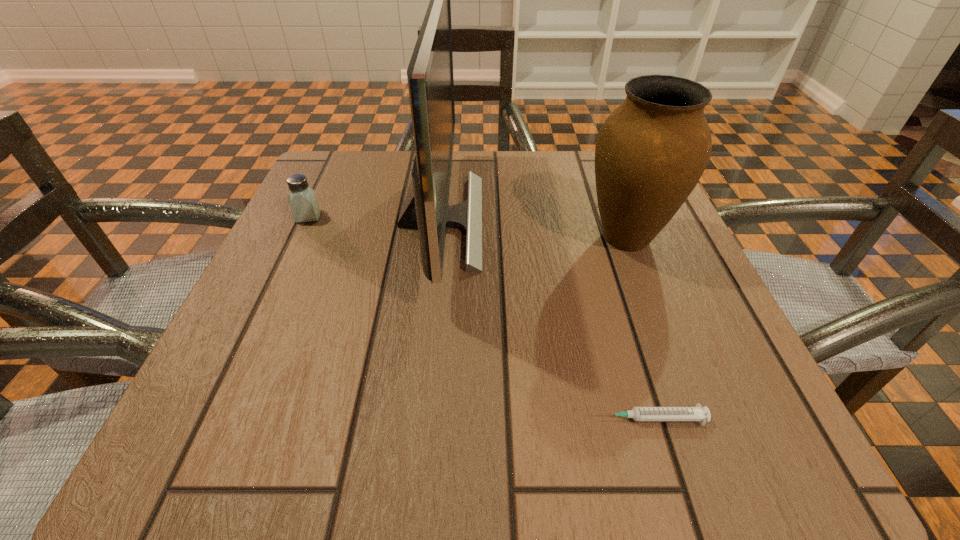
Image resolution: width=960 pixels, height=540 pixels. I want to click on free region that satisfies the following two spatial constraints: 1. on the front side of the urn; 2. on the left side of the leftmost object, so click(299, 238).

Identify the location of free space that satisfies the following two spatial constraints: 1. on the screen side of the second tallest object; 2. on the right side of the tallest object. The width and height of the screenshot is (960, 540). (439, 238).

Locate an element on the screen. Image resolution: width=960 pixels, height=540 pixels. free spot that satisfies the following two spatial constraints: 1. on the screen side of the tallest object; 2. on the back side of the urn is located at coordinates (439, 238).

Locate an element on the screen. free location that satisfies the following two spatial constraints: 1. on the screen side of the urn; 2. on the right side of the tallest object is located at coordinates (439, 238).

The image size is (960, 540). Find the location of `vacant space that satisfies the following two spatial constraints: 1. on the screen side of the monitor; 2. on the right side of the urn`. vacant space that satisfies the following two spatial constraints: 1. on the screen side of the monitor; 2. on the right side of the urn is located at coordinates (439, 238).